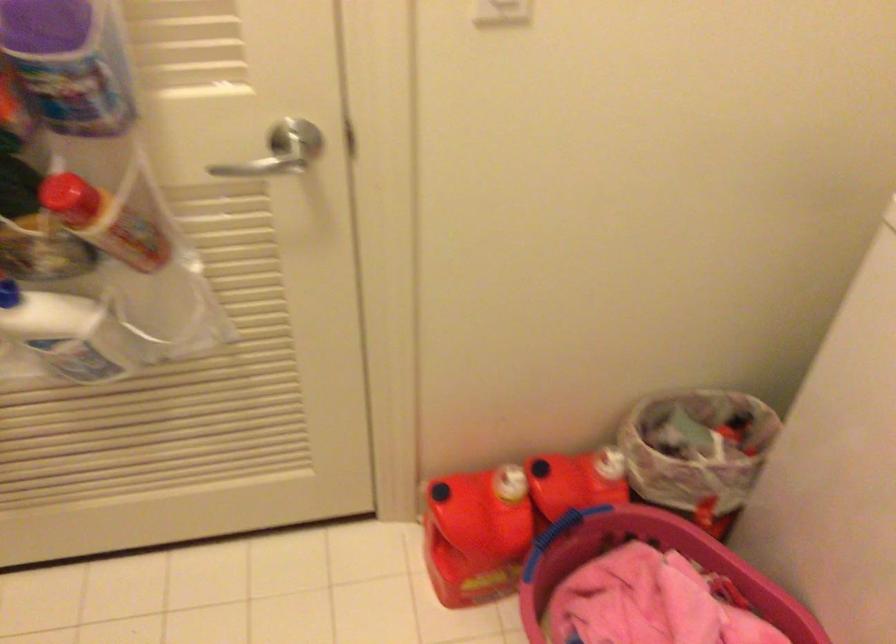
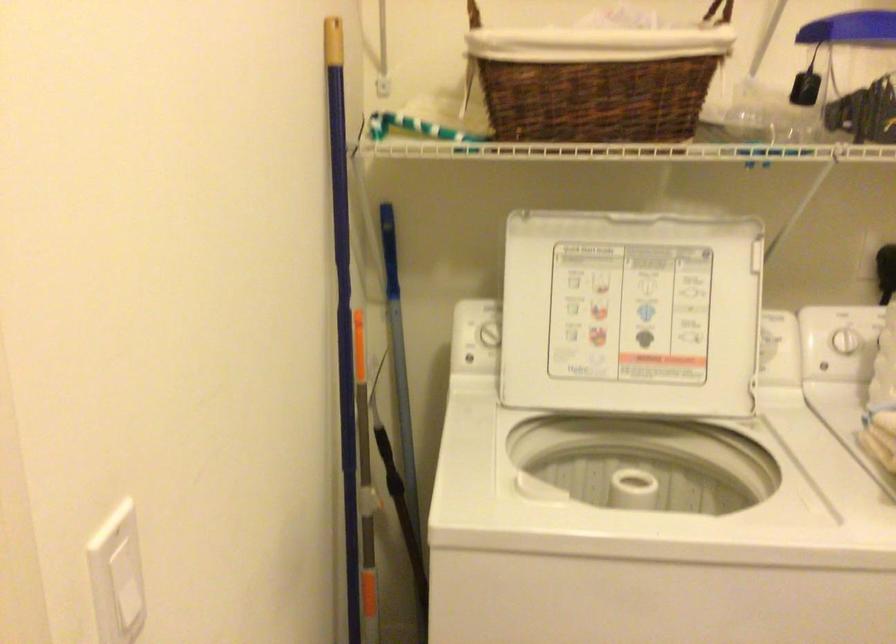
Question: The camera is either moving clockwise (left) or counter-clockwise (right) around the object. The first image is from the beginning of the video and the second image is from the end. Is the camera moving left or right when shooting the video?

Choices:
 (A) Left
 (B) Right

Answer: (A)